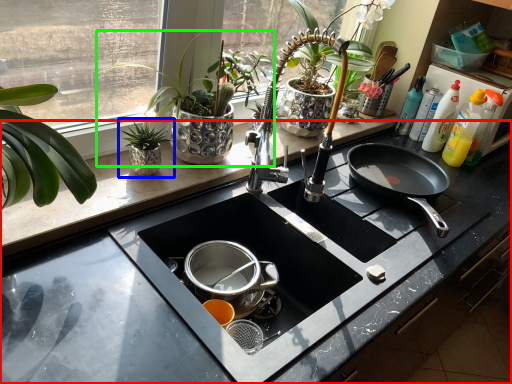
Question: Considering the real-world distances, which object is closest to countertop (highlighted by a red box)? houseplant (highlighted by a blue box) or houseplant (highlighted by a green box).

Choices:
 (A) houseplant
 (B) houseplant

Answer: (B)